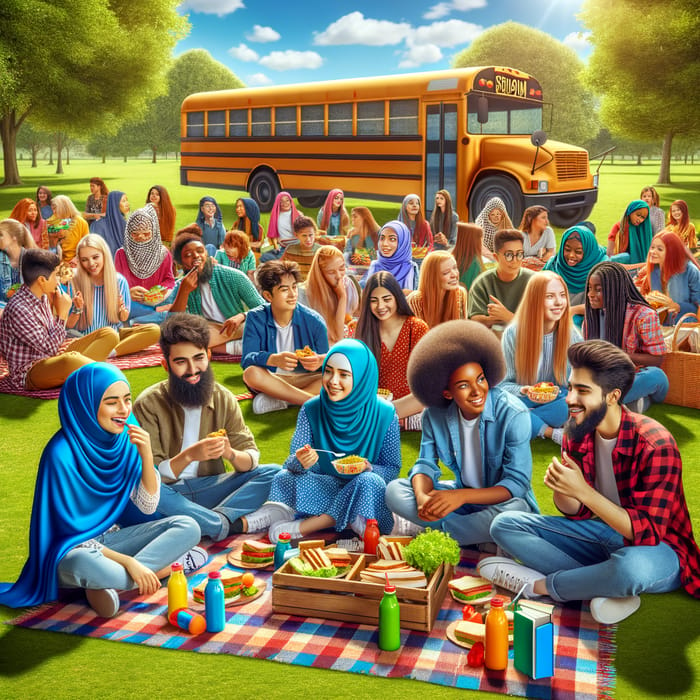
Image resolution: width=700 pixels, height=700 pixels. Identify the location of basket. (322, 598).